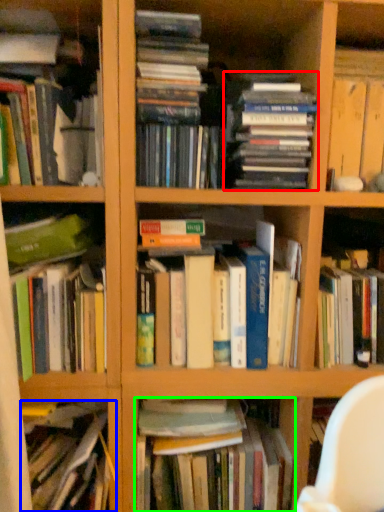
Question: Which is farther away from book (highlighted by a red box)? book (highlighted by a blue box) or book (highlighted by a green box)?

Choices:
 (A) book
 (B) book

Answer: (A)